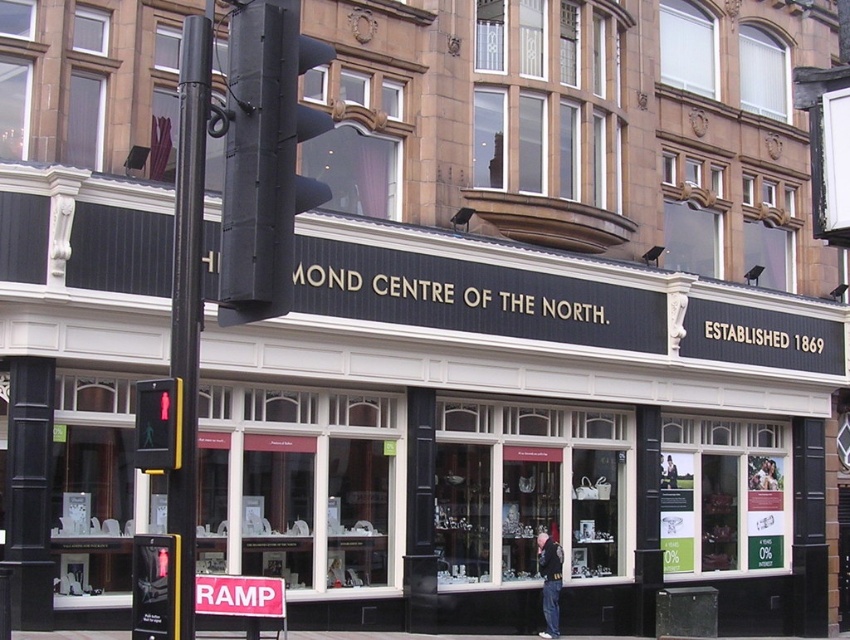
Question: Estimate the real-world distances between objects in this image. Which object is farther from the black plastic traffic light at upper center?

Choices:
 (A) pink plastic sign at lower center
 (B) black glass storefront at center
 (C) red plastic pedestrian signal at left

Answer: (B)

Question: Is yellow plastic traffic light at lower left thinner than red plastic pedestrian signal at left?

Choices:
 (A) no
 (B) yes

Answer: (A)

Question: Among these points, which one is farthest from the camera?

Choices:
 (A) (438, 380)
 (B) (167, 540)

Answer: (A)

Question: Can you confirm if black glass storefront at center is smaller than yellow plastic traffic light at lower left?

Choices:
 (A) yes
 (B) no

Answer: (B)

Question: Is red plastic pedestrian signal at left further to the viewer compared to pink plastic sign at lower center?

Choices:
 (A) yes
 (B) no

Answer: (B)

Question: Which of the following is the closest to the observer?

Choices:
 (A) pink plastic sign at lower center
 (B) red plastic pedestrian signal at left
 (C) yellow plastic traffic light at lower left
 (D) black glass storefront at center

Answer: (C)